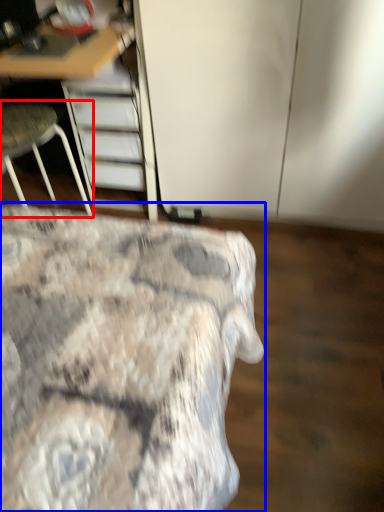
Question: Among these objects, which one is farthest to the camera, chair (highlighted by a red box) or bed (highlighted by a blue box)?

Choices:
 (A) chair
 (B) bed

Answer: (A)